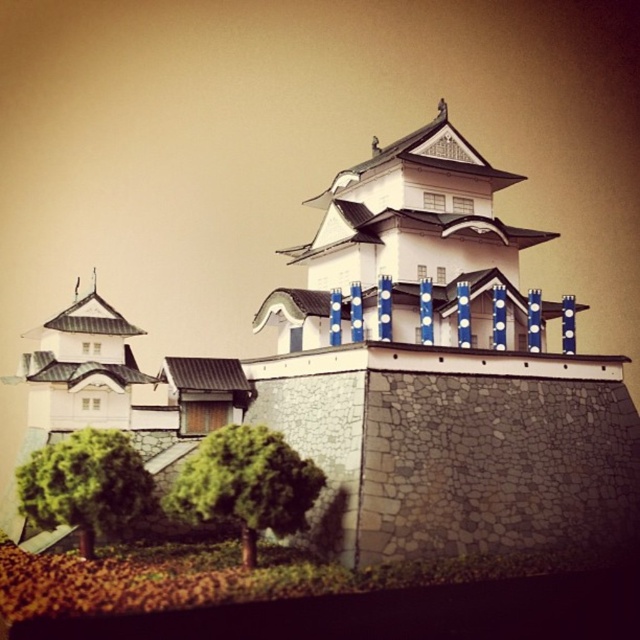
You are a visitor standing in front of the white stone castle at center. You want to take a photo of the castle without any obstructions. Is the green leafy tree at lower center blocking your view of the castle?

The green leafy tree at lower center is behind the white stone castle at center, so it will not block your view of the castle when taking a photo.

You are standing in front of the traditional Japanese castle model and notice two green leafy trees. Which tree is narrower between the green leafy tree at lower center and the green leafy tree at lower left?

The green leafy tree at lower center has a lesser width compared to the green leafy tree at lower left, so it is narrower.